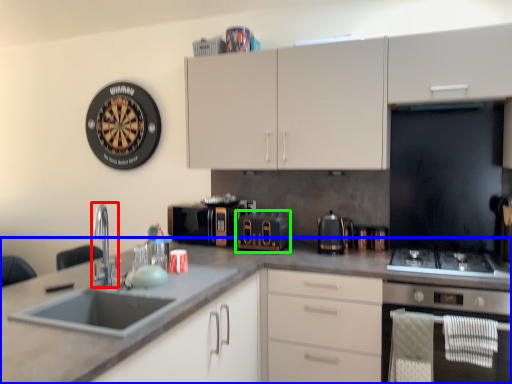
Question: Considering the real-world distances, which object is farthest from tap (highlighted by a red box)? countertop (highlighted by a blue box) or appliance (highlighted by a green box)?

Choices:
 (A) countertop
 (B) appliance

Answer: (B)